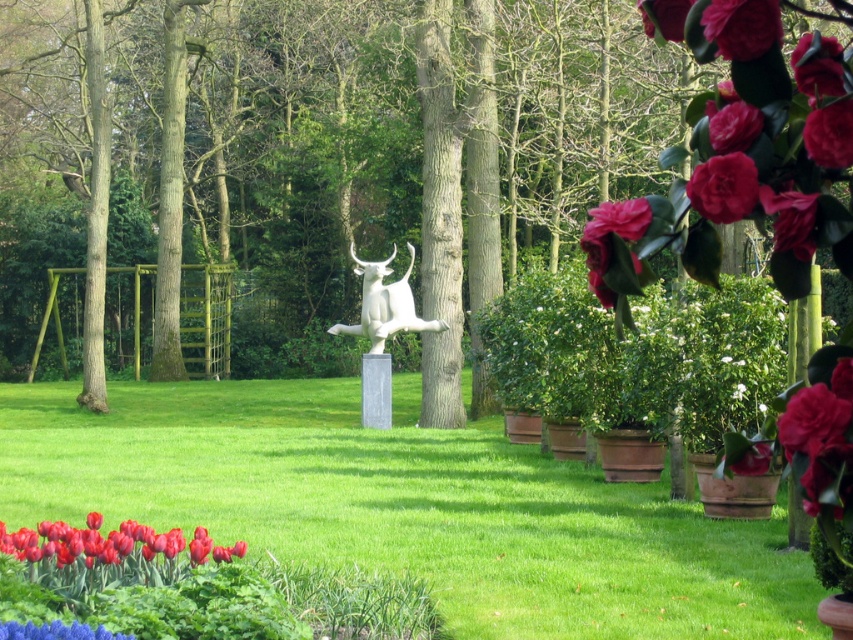
From the picture: Does green matte tree at center appear on the left side of white glossy bull at center?

Correct, you'll find green matte tree at center to the left of white glossy bull at center.

Can you confirm if green matte tree at center is taller than white glossy bull at center?

Correct, green matte tree at center is much taller as white glossy bull at center.

Is point (459, 19) more distant than point (403, 296)?

That is True.

The height and width of the screenshot is (640, 853). What are the coordinates of `green matte tree at center` in the screenshot? It's located at (408, 132).

Can you confirm if smooth glossy tulip at lower left is wider than white glossy bull at center?

Incorrect, smooth glossy tulip at lower left's width does not surpass white glossy bull at center's.

Can you confirm if smooth glossy tulip at lower left is thinner than white glossy bull at center?

Yes.

The width and height of the screenshot is (853, 640). Describe the element at coordinates (91, 545) in the screenshot. I see `smooth glossy tulip at lower left` at that location.

Locate an element on the screen. The image size is (853, 640). smooth glossy tulip at lower left is located at coordinates [91, 545].

Can you confirm if green matte tree at center is smaller than green grass at center?

No, green matte tree at center is not smaller than green grass at center.

Is point (289, 131) positioned after point (267, 518)?

Yes, it is.

Who is more distant from viewer, (503, 84) or (480, 525)?

Point (503, 84)

Where is `green matte tree at center`? green matte tree at center is located at coordinates (408, 132).